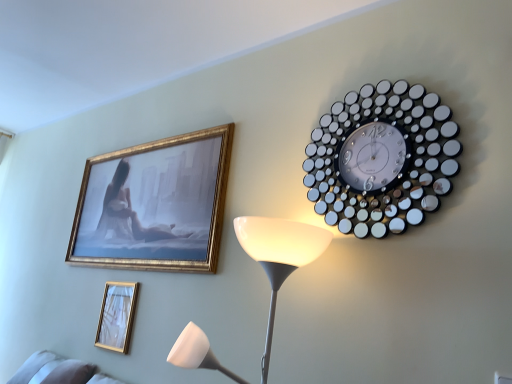
Question: Can you confirm if metallic circular clock at upper right is smaller than gold metallic picture frame at lower left?

Choices:
 (A) no
 (B) yes

Answer: (A)

Question: Does metallic circular clock at upper right lie behind gold metallic picture frame at lower left?

Choices:
 (A) yes
 (B) no

Answer: (B)

Question: Is metallic circular clock at upper right bigger than gold metallic picture frame at lower left?

Choices:
 (A) yes
 (B) no

Answer: (A)

Question: Considering the relative sizes of metallic circular clock at upper right and gold metallic picture frame at lower left in the image provided, is metallic circular clock at upper right wider than gold metallic picture frame at lower left?

Choices:
 (A) yes
 (B) no

Answer: (A)

Question: From the image's perspective, is metallic circular clock at upper right located beneath gold metallic picture frame at lower left?

Choices:
 (A) no
 (B) yes

Answer: (A)

Question: From a real-world perspective, is metallic circular clock at upper right on top of gold metallic picture frame at lower left?

Choices:
 (A) yes
 (B) no

Answer: (A)

Question: Is gold metallic picture frame at lower left positioned far away from metallic circular clock at upper right?

Choices:
 (A) yes
 (B) no

Answer: (A)

Question: Can you confirm if gold metallic picture frame at lower left is taller than metallic circular clock at upper right?

Choices:
 (A) no
 (B) yes

Answer: (A)

Question: Is gold metallic picture frame at lower left completely or partially outside of metallic circular clock at upper right?

Choices:
 (A) no
 (B) yes

Answer: (B)

Question: Could you tell me if gold metallic picture frame at lower left is facing metallic circular clock at upper right?

Choices:
 (A) yes
 (B) no

Answer: (B)

Question: Considering the relative sizes of gold metallic picture frame at lower left and metallic circular clock at upper right in the image provided, is gold metallic picture frame at lower left smaller than metallic circular clock at upper right?

Choices:
 (A) no
 (B) yes

Answer: (B)

Question: From a real-world perspective, is gold metallic picture frame at lower left over metallic circular clock at upper right?

Choices:
 (A) yes
 (B) no

Answer: (B)

Question: In terms of width, does gold metallic picture frame at lower left look wider or thinner when compared to metallic circular clock at upper right?

Choices:
 (A) wide
 (B) thin

Answer: (B)